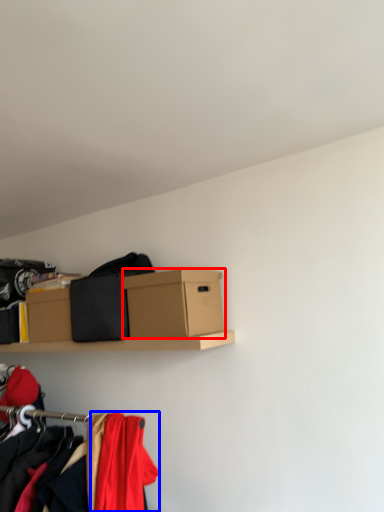
Question: Which object is further to the camera taking this photo, box (highlighted by a red box) or clothing (highlighted by a blue box)?

Choices:
 (A) box
 (B) clothing

Answer: (A)